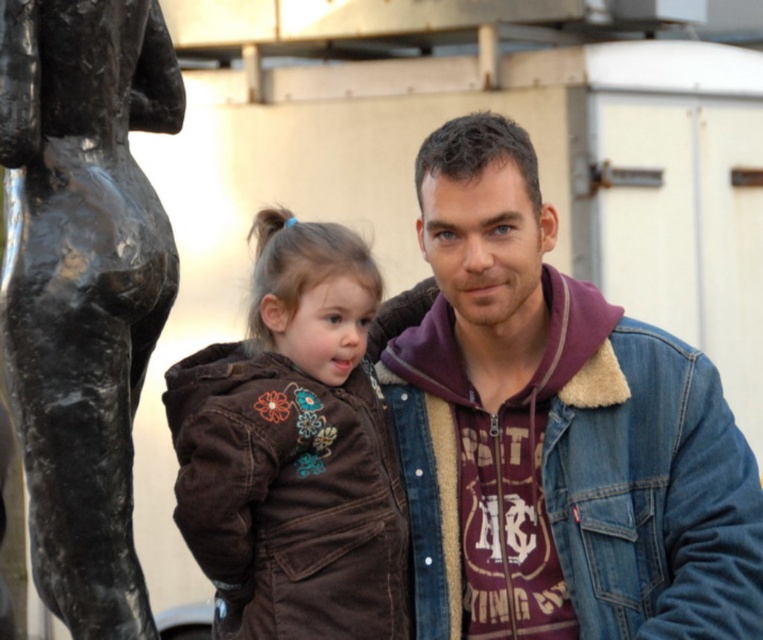
Question: Does black polished statue at left have a lesser width compared to brown corduroy jacket at center?

Choices:
 (A) no
 (B) yes

Answer: (B)

Question: In this image, where is denim jacket at right located relative to brown corduroy jacket at center?

Choices:
 (A) right
 (B) left

Answer: (A)

Question: Which object is closer to the camera taking this photo?

Choices:
 (A) brown corduroy jacket at center
 (B) black polished statue at left
 (C) denim jacket at right

Answer: (B)

Question: Is black polished statue at left further to camera compared to brown corduroy jacket at center?

Choices:
 (A) no
 (B) yes

Answer: (A)

Question: Which point is farther to the camera?

Choices:
 (A) denim jacket at right
 (B) black polished statue at left

Answer: (A)

Question: Which object appears farthest from the camera in this image?

Choices:
 (A) denim jacket at right
 (B) black polished statue at left

Answer: (A)